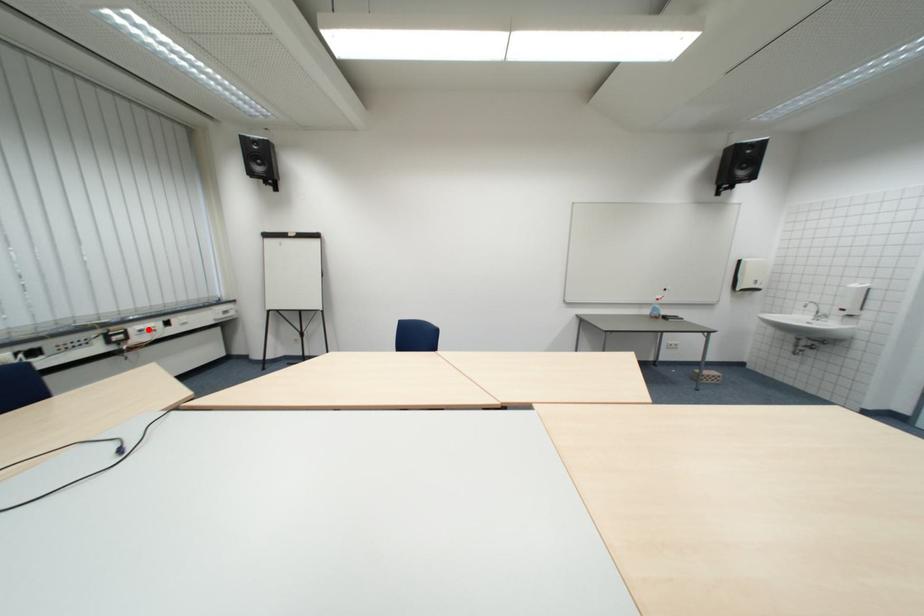
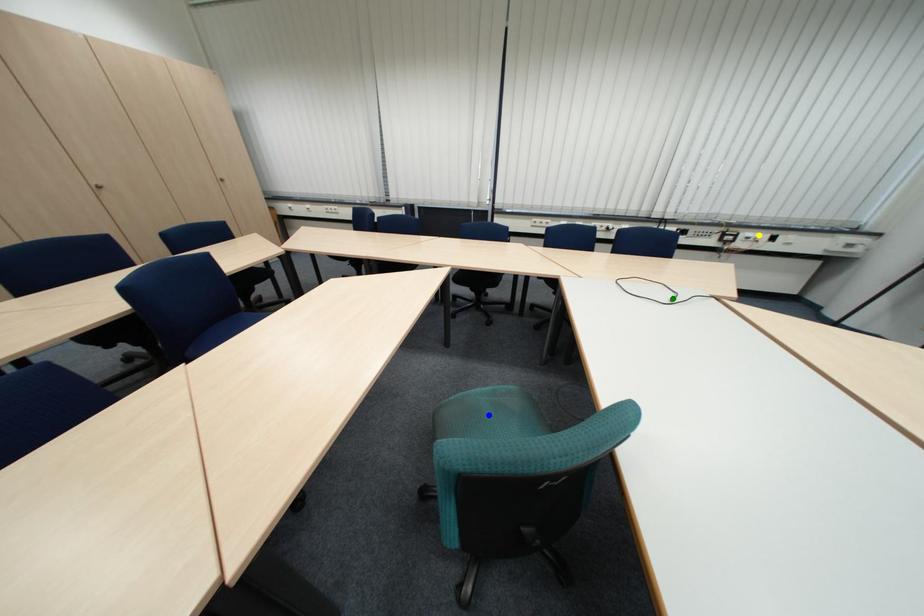
Question: I am providing you with two images of the same scene from different viewpoints. A red point is marked on the first image. You are given multiple points on the second image. Which mark in image 2 goes with the point in image 1?

Choices:
 (A) green point
 (B) blue point
 (C) yellow point

Answer: (C)